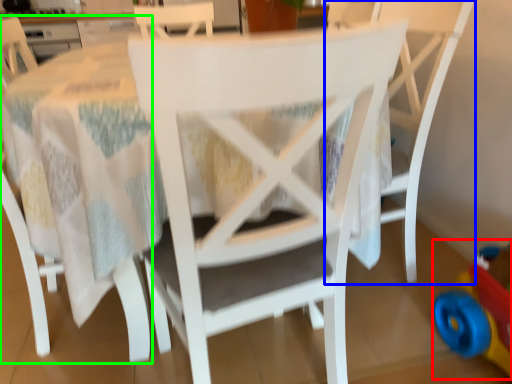
Question: Based on their relative distances, which object is nearer to toy (highlighted by a red box)? Choose from chair (highlighted by a blue box) and chair (highlighted by a green box).

Choices:
 (A) chair
 (B) chair

Answer: (A)